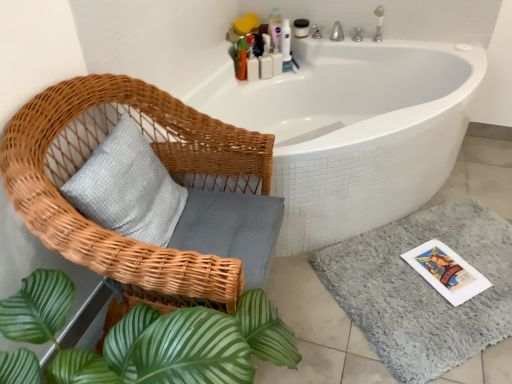
What do you see at coordinates (423, 289) in the screenshot? The width and height of the screenshot is (512, 384). I see `gray shaggy bath mat at lower right` at bounding box center [423, 289].

The width and height of the screenshot is (512, 384). Describe the element at coordinates (159, 158) in the screenshot. I see `woven wood chair at upper left` at that location.

Find the location of a particular element. This screenshot has height=384, width=512. pink plastic bottle at upper center, acting as the third toiletry starting from the right is located at coordinates (275, 27).

Measure the distance between matte white jar at upper center, which ranks as the first toiletry in right-to-left order, and camera.

A distance of 7.69 feet exists between matte white jar at upper center, which ranks as the first toiletry in right-to-left order, and camera.

How much space does white plastic bottles at upper center, arranged as the fourth toiletry when viewed from the left, occupy vertically?

19.14 centimeters.

What is the approximate width of white plastic bottles at upper center, which is the fourth toiletry from right to left?

white plastic bottles at upper center, which is the fourth toiletry from right to left, is 3.40 inches wide.

The height and width of the screenshot is (384, 512). In order to click on translucent plastic bottles at upper right, the fifth toiletry positioned from the right in this screenshot , I will do `click(252, 65)`.

Image resolution: width=512 pixels, height=384 pixels. What do you see at coordinates (252, 65) in the screenshot?
I see `translucent plastic bottles at upper right, the 1th toiletry when ordered from left to right` at bounding box center [252, 65].

I want to click on gray shaggy bath mat at lower right, so click(423, 289).

Would you say pink plastic bottle at upper center, acting as the third toiletry starting from the right, is inside or outside silver metallic tap at upper right?

pink plastic bottle at upper center, acting as the third toiletry starting from the right, is not inside silver metallic tap at upper right, it's outside.

The width and height of the screenshot is (512, 384). In order to click on tap above the pink plastic bottle at upper center, the third toiletry from the left (from a real-world perspective) in this screenshot , I will do `click(357, 34)`.

Are pink plastic bottle at upper center, the third toiletry from the left, and silver metallic tap at upper right beside each other?

No.

From the image's perspective, is pink plastic bottle at upper center, acting as the third toiletry starting from the right, above or below silver metallic tap at upper right?

pink plastic bottle at upper center, acting as the third toiletry starting from the right, is situated higher than silver metallic tap at upper right in the image.

Which point is more distant from viewer, (410, 242) or (321, 142)?

The point (410, 242) is behind.

Which of these two, gray shaggy bath mat at lower right or white glossy bathtub at upper center, stands taller?

white glossy bathtub at upper center.

Does gray shaggy bath mat at lower right contain white glossy bathtub at upper center?

No, white glossy bathtub at upper center is not a part of gray shaggy bath mat at lower right.

Considering the sizes of pink plastic bottle at upper center, the third toiletry from the left, and gray shaggy bath mat at lower right in the image, is pink plastic bottle at upper center, the third toiletry from the left, taller or shorter than gray shaggy bath mat at lower right?

In the image, pink plastic bottle at upper center, the third toiletry from the left, appears to be taller than gray shaggy bath mat at lower right.

Is pink plastic bottle at upper center, the third toiletry from the left, outside of gray shaggy bath mat at lower right?

Yes.

Considering their positions, is pink plastic bottle at upper center, the third toiletry from the left, located in front of or behind gray shaggy bath mat at lower right?

pink plastic bottle at upper center, the third toiletry from the left, is positioned farther from the viewer than gray shaggy bath mat at lower right.

Locate an element on the screen. the 4th toiletry positioned above the gray shaggy bath mat at lower right (from the image's perspective) is located at coordinates (275, 27).

From the picture: From the image's perspective, which one is positioned higher, silver metallic tap at upper right or gray shaggy bath mat at lower right?

silver metallic tap at upper right appears higher in the image.

Choose the correct answer: Is silver metallic tap at upper right inside gray shaggy bath mat at lower right or outside it?

silver metallic tap at upper right is spatially situated outside gray shaggy bath mat at lower right.

Is silver metallic tap at upper right wider or thinner than gray shaggy bath mat at lower right?

Considering their sizes, silver metallic tap at upper right looks slimmer than gray shaggy bath mat at lower right.

Consider the image. Measure the distance between silver metallic tap at upper right and gray shaggy bath mat at lower right.

The distance of silver metallic tap at upper right from gray shaggy bath mat at lower right is 4.69 feet.

Is matte white jar at upper center, which is counted as the 5th toiletry, starting from the left, positioned with its back to gray shaggy bath mat at lower right?

No.

Locate an element on the screen. The width and height of the screenshot is (512, 384). bath mat located below the matte white jar at upper center, which is counted as the 5th toiletry, starting from the left (from the image's perspective) is located at coordinates (423, 289).

Considering the positions of objects matte white jar at upper center, which ranks as the first toiletry in right-to-left order, and gray shaggy bath mat at lower right in the image provided, who is behind, matte white jar at upper center, which ranks as the first toiletry in right-to-left order, or gray shaggy bath mat at lower right?

matte white jar at upper center, which ranks as the first toiletry in right-to-left order, is further from the camera.

From the picture: From the image's perspective, between white plastic bottles at upper center, arranged as the fourth toiletry when viewed from the left, and matte white jar at upper center, which ranks as the first toiletry in right-to-left order, which one is located above?

matte white jar at upper center, which ranks as the first toiletry in right-to-left order, from the image's perspective.

Is white plastic bottles at upper center, arranged as the fourth toiletry when viewed from the left, directly adjacent to matte white jar at upper center, which is counted as the 5th toiletry, starting from the left?

No.

Locate an element on the screen. The image size is (512, 384). the 2nd toiletry below when counting from the matte white jar at upper center, which ranks as the first toiletry in right-to-left order (from the image's perspective) is located at coordinates click(x=277, y=60).

Can you tell me how much white plastic bottles at upper center, arranged as the fourth toiletry when viewed from the left, and matte white jar at upper center, which is counted as the 5th toiletry, starting from the left, differ in facing direction?

52.6 degrees separate the facing orientations of white plastic bottles at upper center, arranged as the fourth toiletry when viewed from the left, and matte white jar at upper center, which is counted as the 5th toiletry, starting from the left.

Could you tell me if woven wood chair at upper left is turned towards white plastic bottles at upper center, which is the fourth toiletry from right to left?

No.

Consider the image. Looking at the image, does woven wood chair at upper left seem bigger or smaller compared to white plastic bottles at upper center, which is the fourth toiletry from right to left?

woven wood chair at upper left is bigger than white plastic bottles at upper center, which is the fourth toiletry from right to left.

Considering the relative sizes of woven wood chair at upper left and white plastic bottles at upper center, which is the fourth toiletry from right to left, in the image provided, is woven wood chair at upper left shorter than white plastic bottles at upper center, which is the fourth toiletry from right to left,?

No.

Between woven wood chair at upper left and white plastic bottles at upper center, which is the fourth toiletry from right to left, which one has larger width?

woven wood chair at upper left.

I want to click on tap in front of the pink plastic bottle at upper center, the third toiletry from the left, so click(x=357, y=34).

Image resolution: width=512 pixels, height=384 pixels. I want to click on bathtub that is above the gray shaggy bath mat at lower right (from a real-world perspective), so click(x=350, y=127).

Estimate the real-world distances between objects in this image. Which object is further from white plastic bottles at upper center, the second toiletry when ordered from left to right, matte white jar at upper center, which ranks as the first toiletry in right-to-left order, or white plastic bottles at upper center, arranged as the fourth toiletry when viewed from the left?

Based on the image, matte white jar at upper center, which ranks as the first toiletry in right-to-left order, appears to be further to white plastic bottles at upper center, the second toiletry when ordered from left to right.

Which object lies nearer to the anchor point silver metallic tap at upper right, woven wood chair at upper left or translucent plastic bottles at upper right, the 1th toiletry when ordered from left to right?

translucent plastic bottles at upper right, the 1th toiletry when ordered from left to right, is closer to silver metallic tap at upper right.

Considering their positions, is woven wood chair at upper left positioned further to silver metallic tap at upper right than gray shaggy bath mat at lower right?

woven wood chair at upper left lies further to silver metallic tap at upper right than the other object.

Consider the image. From the image, which object appears to be farther from translucent plastic bottles at upper right, the fifth toiletry positioned from the right, white plastic bottles at upper center, the second toiletry when ordered from left to right, or pink plastic bottle at upper center, the third toiletry from the left?

pink plastic bottle at upper center, the third toiletry from the left.

Looking at the image, which one is located closer to white glossy bathtub at upper center, silver metallic tap at upper right or white plastic bottles at upper center, arranged as the fourth toiletry when viewed from the left?

Among the two, white plastic bottles at upper center, arranged as the fourth toiletry when viewed from the left, is located nearer to white glossy bathtub at upper center.

Looking at this image, when comparing their distances from silver metallic tap at upper right, does white plastic bottles at upper center, the second toiletry when ordered from left to right, or gray shaggy bath mat at lower right seem closer?

Among the two, white plastic bottles at upper center, the second toiletry when ordered from left to right, is located nearer to silver metallic tap at upper right.

Consider the image. From the image, which object appears to be nearer to white plastic bottles at upper center, arranged as the fourth toiletry when viewed from the left, matte white jar at upper center, which ranks as the first toiletry in right-to-left order, or white plastic bottles at upper center, which is the fourth toiletry from right to left?

white plastic bottles at upper center, which is the fourth toiletry from right to left, is positioned closer to the anchor white plastic bottles at upper center, arranged as the fourth toiletry when viewed from the left.

Based on their spatial positions, is translucent plastic bottles at upper right, the fifth toiletry positioned from the right, or white plastic bottles at upper center, which is the fourth toiletry from right to left, closer to white plastic bottles at upper center, arranged as the fourth toiletry when viewed from the left?

Based on the image, white plastic bottles at upper center, which is the fourth toiletry from right to left, appears to be nearer to white plastic bottles at upper center, arranged as the fourth toiletry when viewed from the left.

Find the location of `toiletry between matte white jar at upper center, which ranks as the first toiletry in right-to-left order, and white plastic bottles at upper center, positioned as the second toiletry in right-to-left order, in the vertical direction`. toiletry between matte white jar at upper center, which ranks as the first toiletry in right-to-left order, and white plastic bottles at upper center, positioned as the second toiletry in right-to-left order, in the vertical direction is located at coordinates (275, 27).

The height and width of the screenshot is (384, 512). In order to click on bath mat positioned between woven wood chair at upper left and pink plastic bottle at upper center, acting as the third toiletry starting from the right, from near to far in this screenshot , I will do `click(423, 289)`.

Where is `toiletry between woven wood chair at upper left and white plastic bottles at upper center, which is the fourth toiletry from right to left, from front to back`? toiletry between woven wood chair at upper left and white plastic bottles at upper center, which is the fourth toiletry from right to left, from front to back is located at coordinates (252, 65).

Find the location of `tap between matte white jar at upper center, which is counted as the 5th toiletry, starting from the left, and gray shaggy bath mat at lower right from top to bottom`. tap between matte white jar at upper center, which is counted as the 5th toiletry, starting from the left, and gray shaggy bath mat at lower right from top to bottom is located at coordinates (357, 34).